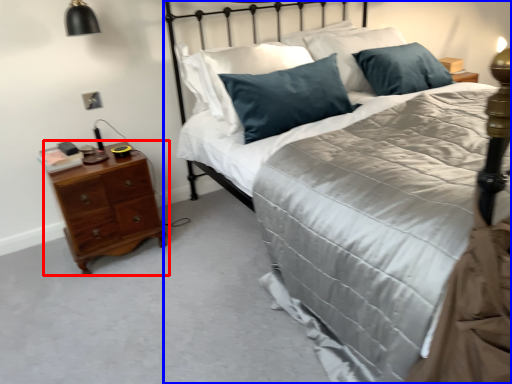
Question: Which object appears farthest to the camera in this image, nightstand (highlighted by a red box) or bed (highlighted by a blue box)?

Choices:
 (A) nightstand
 (B) bed

Answer: (A)